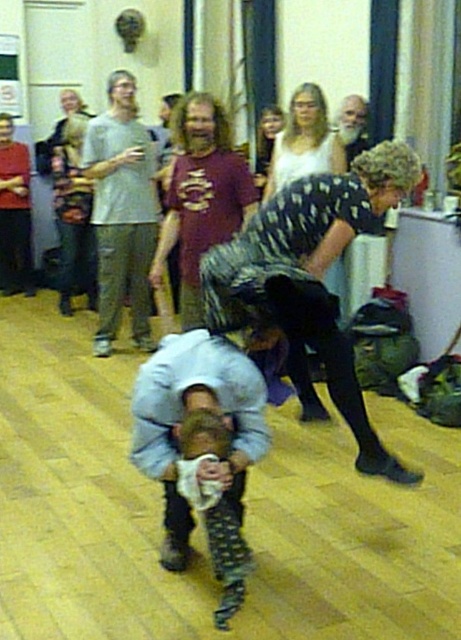
You are organizing a costume party and need to decide which outfit to choose between the patterned fabric dress at center and the light blue denim shirt at center. Based on their sizes, which one would be more suitable for a performance that requires flexibility and ease of movement?

The light blue denim shirt at center is smaller and thus more suitable for a performance requiring flexibility and ease of movement since it allows for greater mobility compared to the larger patterned fabric dress at center.

Based on the scene description, where is the light blue denim shirt at center located in terms of coordinates?

The light blue denim shirt at center is located at coordinates point (x=201, y=449).

You are standing at the origin point of the coordinate system. You see two points, point(228,429) and point(307,122). Which point is closer to you?

Point(228,429) is in front of point(307,122), so it is closer to you.